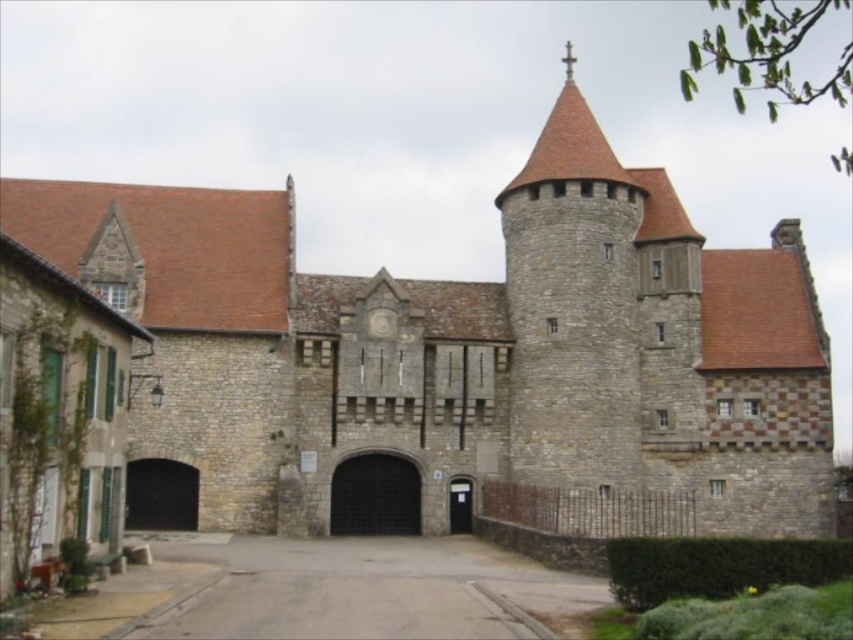
Question: Among these objects, which one is nearest to the camera?

Choices:
 (A) dark gray stone gate at center
 (B) dark brown stone archway at lower left

Answer: (B)

Question: Does gray asphalt driveway at center appear on the left side of dark brown stone archway at lower left?

Choices:
 (A) no
 (B) yes

Answer: (A)

Question: Is dark gray stone gate at center above dark brown stone archway at lower left?

Choices:
 (A) yes
 (B) no

Answer: (A)

Question: Estimate the real-world distances between objects in this image. Which object is farther from the dark gray stone gate at center?

Choices:
 (A) dark brown stone archway at lower left
 (B) gray asphalt driveway at center

Answer: (A)

Question: Among these objects, which one is nearest to the camera?

Choices:
 (A) dark gray stone gate at center
 (B) black metal gate at center
 (C) dark brown stone archway at lower left
 (D) gray asphalt driveway at center

Answer: (D)

Question: Observing the image, what is the correct spatial positioning of dark gray stone gate at center in reference to dark brown stone archway at lower left?

Choices:
 (A) above
 (B) below

Answer: (A)